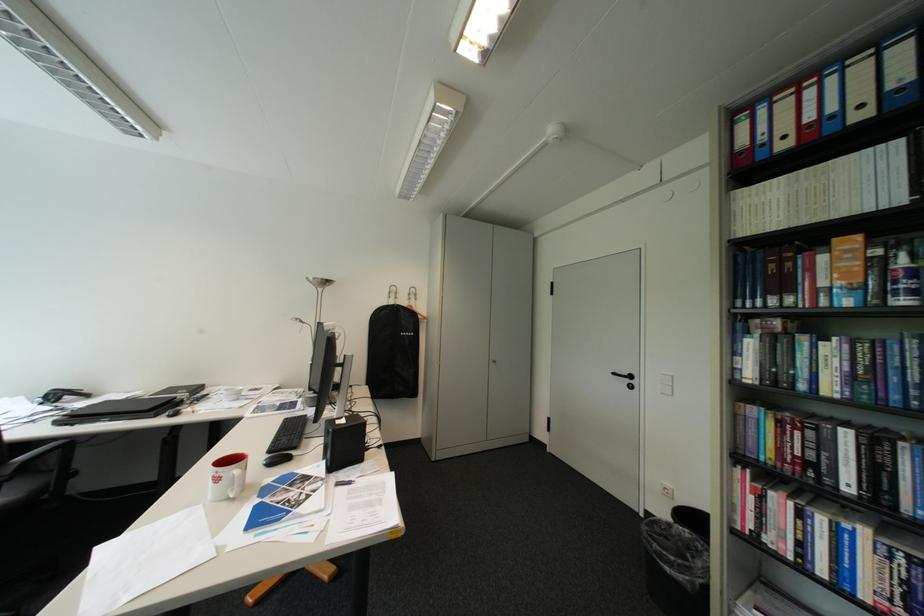
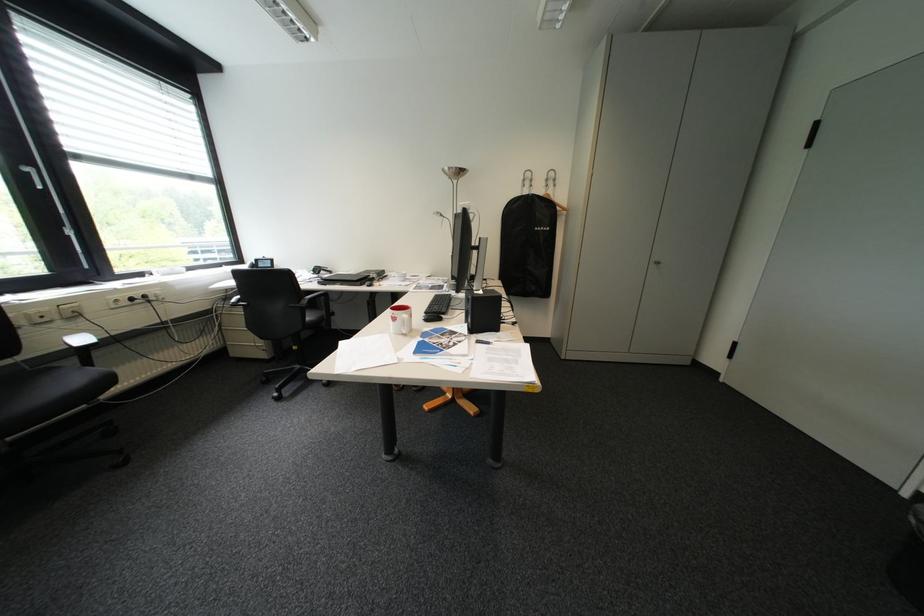
Locate, in the second image, the point that corresponds to (x=228, y=480) in the first image.

(407, 320)